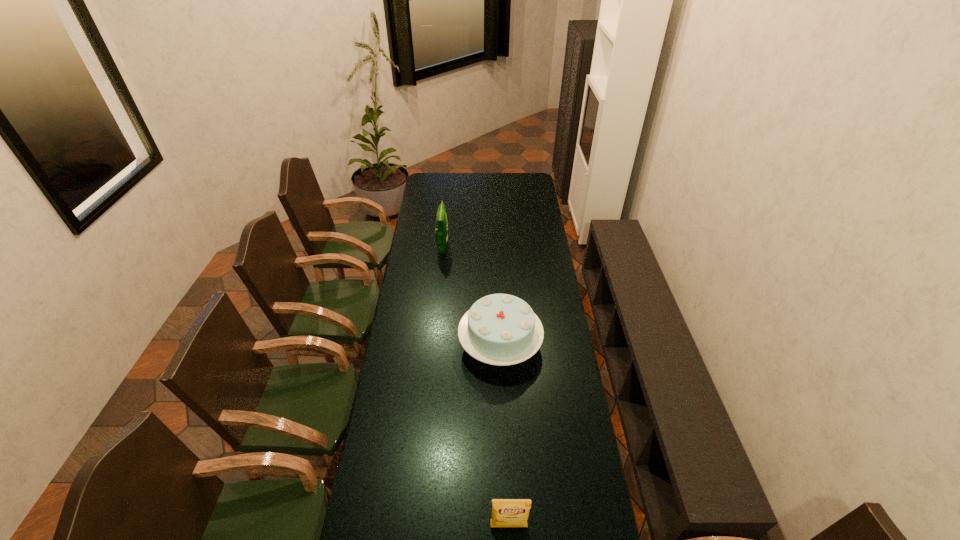
Image resolution: width=960 pixels, height=540 pixels. What are the coordinates of `object that is the closest to the left crisp (potato chip)` in the screenshot? It's located at (499, 329).

Locate an element on the screen. The image size is (960, 540). vacant region that satisfies the following two spatial constraints: 1. on the back side of the birthday cake; 2. on the front-facing side of the left crisp (potato chip) is located at coordinates (496, 247).

Where is `vacant space that satisfies the following two spatial constraints: 1. on the front-facing side of the left crisp (potato chip); 2. on the left side of the birthday cake`? This screenshot has height=540, width=960. vacant space that satisfies the following two spatial constraints: 1. on the front-facing side of the left crisp (potato chip); 2. on the left side of the birthday cake is located at coordinates 433,345.